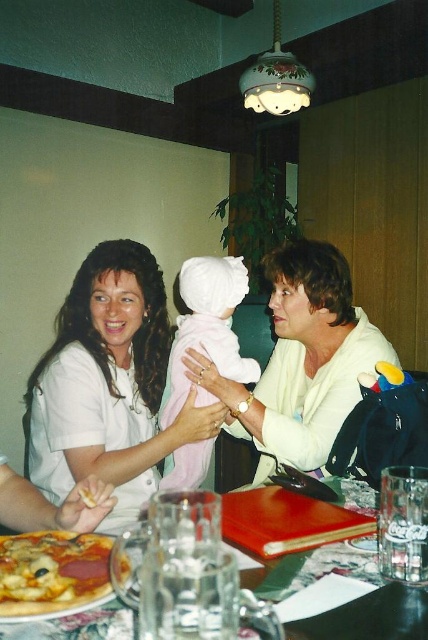
Question: Does white matte shirt at center appear under pink soft fabric baby at center?

Choices:
 (A) no
 (B) yes

Answer: (B)

Question: Which point is closer to the camera taking this photo?

Choices:
 (A) (222, 278)
 (B) (56, 604)
 (C) (308, 333)
 (D) (89, 301)

Answer: (B)

Question: Which point is farther to the camera?

Choices:
 (A) (47, 580)
 (B) (235, 339)

Answer: (B)

Question: Does matte white sweater at center have a smaller size compared to golden crispy pizza at lower left?

Choices:
 (A) yes
 (B) no

Answer: (B)

Question: Where is white matte shirt at center located in relation to golden crispy pizza at lower left in the image?

Choices:
 (A) below
 (B) above

Answer: (B)

Question: Estimate the real-world distances between objects in this image. Which object is farther from the golden crispy pizza at lower left?

Choices:
 (A) pink soft fabric baby at center
 (B) matte plastic plate at lower left
 (C) matte white sweater at center

Answer: (C)